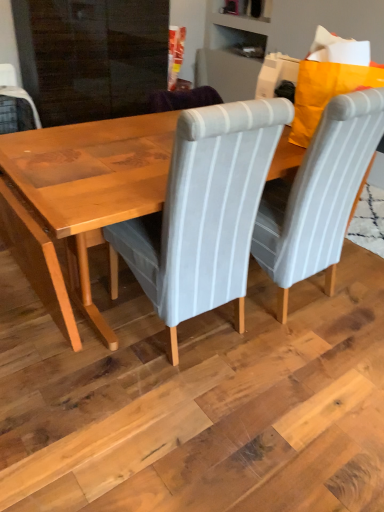
I want to click on vacant space in light gray fabric chair at center, the 2th chair from the right (from a real-world perspective), so click(177, 326).